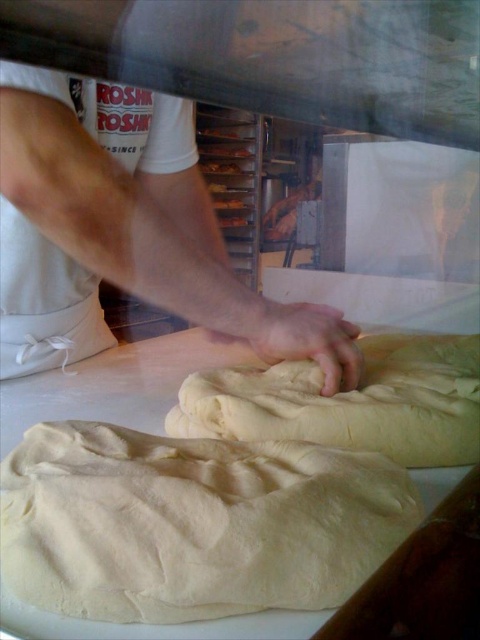
Does white fabric arm at upper left appear under smooth white hand at center?

Actually, white fabric arm at upper left is above smooth white hand at center.

Can you confirm if white fabric arm at upper left is positioned to the right of smooth white hand at center?

In fact, white fabric arm at upper left is to the left of smooth white hand at center.

Who is more forward, (168, 196) or (349, 339)?

Point (349, 339) is more forward.

This screenshot has width=480, height=640. I want to click on white fabric arm at upper left, so click(x=124, y=228).

Does white soft dough at center have a greater width compared to smooth white hand at center?

Yes, white soft dough at center is wider than smooth white hand at center.

Which is above, white soft dough at center or smooth white hand at center?

Positioned higher is smooth white hand at center.

Describe the element at coordinates (349, 403) in the screenshot. The height and width of the screenshot is (640, 480). I see `white soft dough at center` at that location.

Where is `white soft dough at center`? Image resolution: width=480 pixels, height=640 pixels. white soft dough at center is located at coordinates (349, 403).

Which is below, white fluffy dough at center or white fabric arm at upper left?

Positioned lower is white fluffy dough at center.

Between point (403, 518) and point (324, 308), which one is positioned in front?

Point (403, 518) is in front.

Is point (292, 579) positioned behind point (180, 216)?

No, it is not.

You are a GUI agent. You are given a task and a screenshot of the screen. Output one action in this format:
    pyautogui.click(x=<x>, y=<y>)
    Task: Click on the white fluffy dough at center
    This screenshot has height=640, width=480.
    Given the screenshot: What is the action you would take?
    pyautogui.click(x=192, y=524)